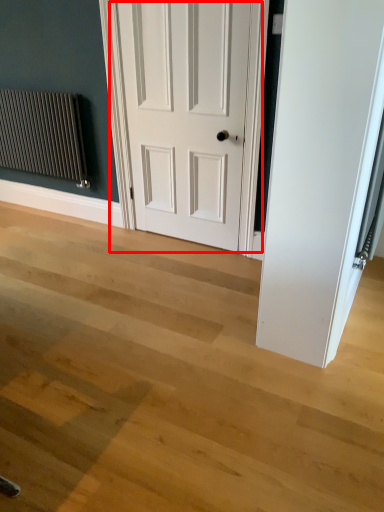
Question: From the image's perspective, considering the relative positions of door (annotated by the red box) and radiator in the image provided, where is door (annotated by the red box) located with respect to the staircase?

Choices:
 (A) below
 (B) above

Answer: (A)